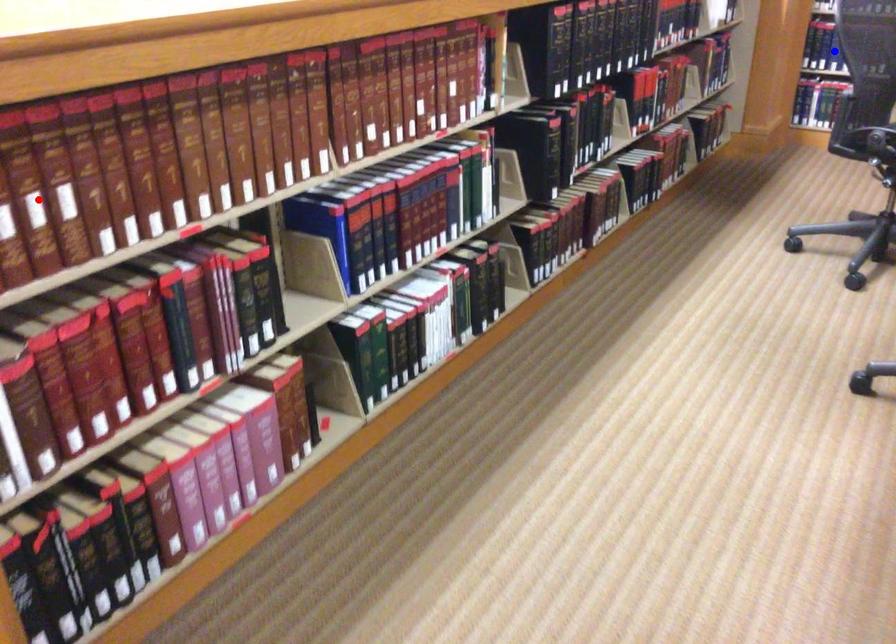
Question: In the image, two points are highlighted. Which point is nearer to the camera? Reply with the corresponding letter.

Choices:
 (A) blue point
 (B) red point

Answer: (B)